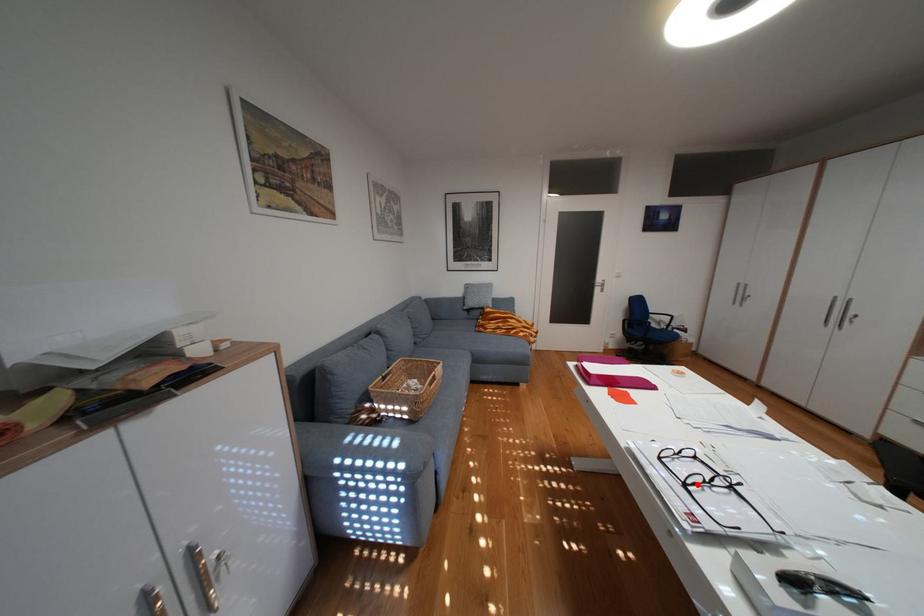
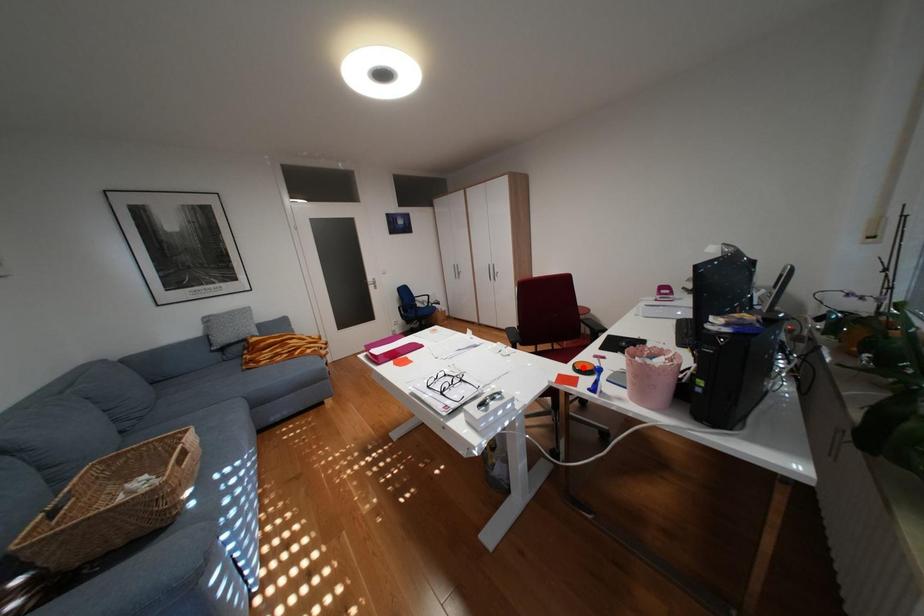
I am providing you with two images of the same scene from different viewpoints. A red point is marked on the first image and another point is marked on the second image. Is the marked point in image1 the same physical position as the marked point in image2?

No